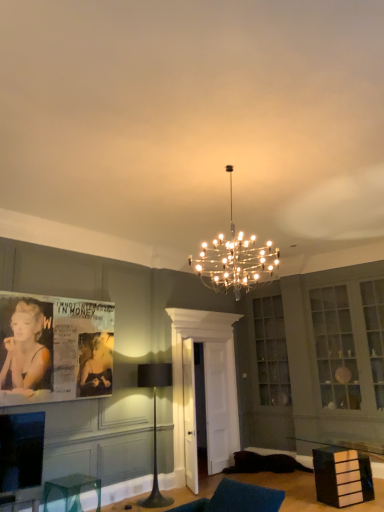
This screenshot has width=384, height=512. Find the location of `clear glass door at center`. clear glass door at center is located at coordinates (206, 385).

Where is `clear glass chandelier at center, which is the 1th lamp in top-to-bottom order`? clear glass chandelier at center, which is the 1th lamp in top-to-bottom order is located at coordinates (235, 260).

The height and width of the screenshot is (512, 384). Describe the element at coordinates (73, 490) in the screenshot. I see `clear glass cube at lower left, which appears as the second furniture when viewed from the right` at that location.

In order to click on clear glass cube at lower left, the 1th furniture positioned from the left in this screenshot , I will do `click(73, 490)`.

What do you see at coordinates (155, 423) in the screenshot?
I see `black matte floor lamp at center, which is the 1th lamp from left to right` at bounding box center [155, 423].

The width and height of the screenshot is (384, 512). What do you see at coordinates (342, 476) in the screenshot?
I see `black glossy drawer at lower right, which is the first furniture from right to left` at bounding box center [342, 476].

At what (x,y) coordinates should I click in order to perform the action: click on clear glass door at center. Please return your answer as a coordinate pair (x, y). The height and width of the screenshot is (512, 384). Looking at the image, I should click on (206, 385).

Between clear glass chandelier at center, acting as the 1th lamp starting from the front, and black matte floor lamp at center, placed as the first lamp when sorted from bottom to top, which one has smaller size?

Smaller between the two is black matte floor lamp at center, placed as the first lamp when sorted from bottom to top.

Is point (258, 247) positioned after point (154, 446)?

Yes, point (258, 247) is behind point (154, 446).

This screenshot has width=384, height=512. Find the location of `lamp above the black matte floor lamp at center, which is the 1th lamp from left to right (from the image's perspective)`. lamp above the black matte floor lamp at center, which is the 1th lamp from left to right (from the image's perspective) is located at coordinates [235, 260].

From a real-world perspective, which object stands above the other?

clear glass door at center, from a real-world perspective.

Would you say clear glass door at center is a long distance from black glossy drawer at lower right, acting as the 2th furniture starting from the left?

clear glass door at center is far away from black glossy drawer at lower right, acting as the 2th furniture starting from the left.

From the image's perspective, is clear glass door at center on black glossy drawer at lower right, acting as the 2th furniture starting from the left?

Correct, clear glass door at center appears higher than black glossy drawer at lower right, acting as the 2th furniture starting from the left, in the image.

Does clear glass door at center contain black glossy drawer at lower right, which is the first furniture from right to left?

No, black glossy drawer at lower right, which is the first furniture from right to left, is not a part of clear glass door at center.

Does point (344, 493) lie behind point (164, 380)?

No, it is not.

From the image's perspective, is black glossy drawer at lower right, which is the first furniture from right to left, located beneath black matte floor lamp at center, which appears as the second lamp when viewed from the front?

Yes, from the image's perspective, black glossy drawer at lower right, which is the first furniture from right to left, is below black matte floor lamp at center, which appears as the second lamp when viewed from the front.

From a real-world perspective, is black glossy drawer at lower right, acting as the 2th furniture starting from the left, physically located above or below black matte floor lamp at center, arranged as the 2th lamp when viewed from the top?

black glossy drawer at lower right, acting as the 2th furniture starting from the left, is below black matte floor lamp at center, arranged as the 2th lamp when viewed from the top.

Is black glossy drawer at lower right, which is the first furniture from right to left, oriented towards black matte floor lamp at center, which appears as the second lamp when viewed from the front?

No.

Is clear glass door at center outside of black matte floor lamp at center, placed as the first lamp when sorted from bottom to top?

clear glass door at center lies outside black matte floor lamp at center, placed as the first lamp when sorted from bottom to top,'s area.

Looking at their sizes, would you say clear glass door at center is wider or thinner than black matte floor lamp at center, which appears as the second lamp when viewed from the front?

Clearly, clear glass door at center has less width compared to black matte floor lamp at center, which appears as the second lamp when viewed from the front.

How distant is clear glass door at center from black matte floor lamp at center, placed as the first lamp when sorted from bottom to top?

clear glass door at center is 36.33 inches from black matte floor lamp at center, placed as the first lamp when sorted from bottom to top.

Considering the positions of objects clear glass door at center and black matte floor lamp at center, placed as the first lamp when sorted from bottom to top, in the image provided, who is more to the left, clear glass door at center or black matte floor lamp at center, placed as the first lamp when sorted from bottom to top,?

black matte floor lamp at center, placed as the first lamp when sorted from bottom to top.

Considering the relative sizes of clear glass chandelier at center, which is the 1th lamp in top-to-bottom order, and matte paper poster at left in the image provided, is clear glass chandelier at center, which is the 1th lamp in top-to-bottom order, wider than matte paper poster at left?

Yes, clear glass chandelier at center, which is the 1th lamp in top-to-bottom order, is wider than matte paper poster at left.

Can you confirm if clear glass chandelier at center, acting as the 2th lamp starting from the bottom, is bigger than matte paper poster at left?

Yes.

Do you think clear glass chandelier at center, the first lamp when ordered from right to left, is within matte paper poster at left, or outside of it?

clear glass chandelier at center, the first lamp when ordered from right to left, is outside matte paper poster at left.

Where is `glass door on the left of black glossy drawer at lower right, which is the first furniture from right to left`? glass door on the left of black glossy drawer at lower right, which is the first furniture from right to left is located at coordinates (206, 385).

Consider the image. Which object is wider, black glossy drawer at lower right, acting as the 2th furniture starting from the left, or clear glass door at center?

black glossy drawer at lower right, acting as the 2th furniture starting from the left, is wider.

Does point (329, 468) lie in front of point (179, 350)?

Yes, it is.

How different are the orientations of black matte floor lamp at center, which is the 1th lamp from left to right, and clear glass cube at lower left, the 1th furniture positioned from the left, in degrees?

black matte floor lamp at center, which is the 1th lamp from left to right, and clear glass cube at lower left, the 1th furniture positioned from the left, are facing 0.186 degrees away from each other.

Can you confirm if black matte floor lamp at center, the 1th lamp in the back-to-front sequence, is taller than clear glass cube at lower left, which appears as the second furniture when viewed from the right?

Indeed, black matte floor lamp at center, the 1th lamp in the back-to-front sequence, has a greater height compared to clear glass cube at lower left, which appears as the second furniture when viewed from the right.

Could you tell me if black matte floor lamp at center, which appears as the second lamp when viewed from the front, is facing clear glass cube at lower left, which appears as the second furniture when viewed from the right?

No.

Is point (150, 369) closer or farther from the camera than point (86, 486)?

Point (150, 369) is farther from the camera than point (86, 486).

The width and height of the screenshot is (384, 512). In order to click on lamp on the right of the black matte floor lamp at center, which is the 1th lamp from left to right in this screenshot , I will do `click(235, 260)`.

I want to click on the 1st furniture below the clear glass door at center (from the image's perspective), so click(x=342, y=476).

When comparing their distances from clear glass door at center, does clear glass chandelier at center, the first lamp when ordered from right to left, or black glossy drawer at lower right, which is the first furniture from right to left, seem further?

The object further to clear glass door at center is black glossy drawer at lower right, which is the first furniture from right to left.

Looking at the image, which one is located closer to clear glass chandelier at center, positioned as the 2th lamp in back-to-front order, clear glass cube at lower left, the 1th furniture positioned from the left, or clear glass door at center?

clear glass door at center lies closer to clear glass chandelier at center, positioned as the 2th lamp in back-to-front order, than the other object.

When comparing their distances from clear glass door at center, does matte paper poster at left or clear glass chandelier at center, acting as the 2th lamp starting from the bottom, seem further?

matte paper poster at left is further to clear glass door at center.

Looking at the image, which one is located further to clear glass door at center, black matte floor lamp at center, arranged as the 2th lamp when viewed from the top, or clear glass cube at lower left, the 1th furniture positioned from the left?

clear glass cube at lower left, the 1th furniture positioned from the left, is further to clear glass door at center.

Considering their positions, is clear glass cube at lower left, which appears as the second furniture when viewed from the right, positioned closer to black matte floor lamp at center, placed as the first lamp when sorted from bottom to top, than matte paper poster at left?

matte paper poster at left is closer to black matte floor lamp at center, placed as the first lamp when sorted from bottom to top.

Estimate the real-world distances between objects in this image. Which object is closer to clear glass chandelier at center, acting as the 1th lamp starting from the front, matte paper poster at left or clear glass door at center?

clear glass door at center.

Looking at the image, which one is located closer to clear glass door at center, clear glass cube at lower left, the 1th furniture positioned from the left, or black glossy drawer at lower right, which is the first furniture from right to left?

Among the two, black glossy drawer at lower right, which is the first furniture from right to left, is located nearer to clear glass door at center.

Looking at the image, which one is located closer to black matte floor lamp at center, placed as the first lamp when sorted from bottom to top, matte paper poster at left or clear glass chandelier at center, the first lamp when ordered from right to left?

Among the two, matte paper poster at left is located nearer to black matte floor lamp at center, placed as the first lamp when sorted from bottom to top.

You are a GUI agent. You are given a task and a screenshot of the screen. Output one action in this format:
    pyautogui.click(x=<x>, y=<y>)
    Task: Click on the glass door between clear glass cube at lower left, the 1th furniture positioned from the left, and black glossy drawer at lower right, which is the first furniture from right to left, from left to right
    The width and height of the screenshot is (384, 512).
    Given the screenshot: What is the action you would take?
    pyautogui.click(x=206, y=385)

Where is `lamp between clear glass chandelier at center, the second lamp viewed from the left, and black glossy drawer at lower right, which is the first furniture from right to left, vertically`? Image resolution: width=384 pixels, height=512 pixels. lamp between clear glass chandelier at center, the second lamp viewed from the left, and black glossy drawer at lower right, which is the first furniture from right to left, vertically is located at coordinates (155, 423).

Where is `poster page between clear glass chandelier at center, which is the 1th lamp in top-to-bottom order, and black matte floor lamp at center, the 1th lamp in the back-to-front sequence, in the vertical direction`? poster page between clear glass chandelier at center, which is the 1th lamp in top-to-bottom order, and black matte floor lamp at center, the 1th lamp in the back-to-front sequence, in the vertical direction is located at coordinates (54, 348).

At what (x,y) coordinates should I click in order to perform the action: click on glass door between clear glass chandelier at center, acting as the 2th lamp starting from the bottom, and clear glass cube at lower left, the 1th furniture positioned from the left, in the up-down direction. Please return your answer as a coordinate pair (x, y). The height and width of the screenshot is (512, 384). Looking at the image, I should click on (206, 385).